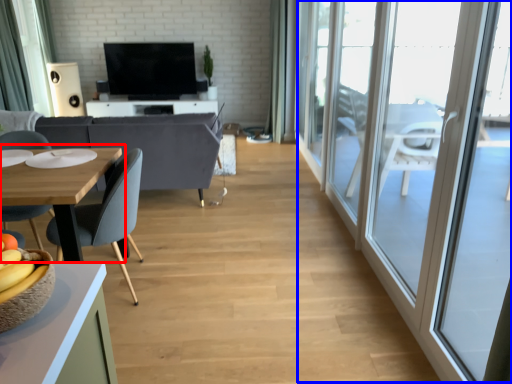
Question: Which of the following is the closest to the observer, table (highlighted by a red box) or screen door (highlighted by a blue box)?

Choices:
 (A) table
 (B) screen door

Answer: (B)